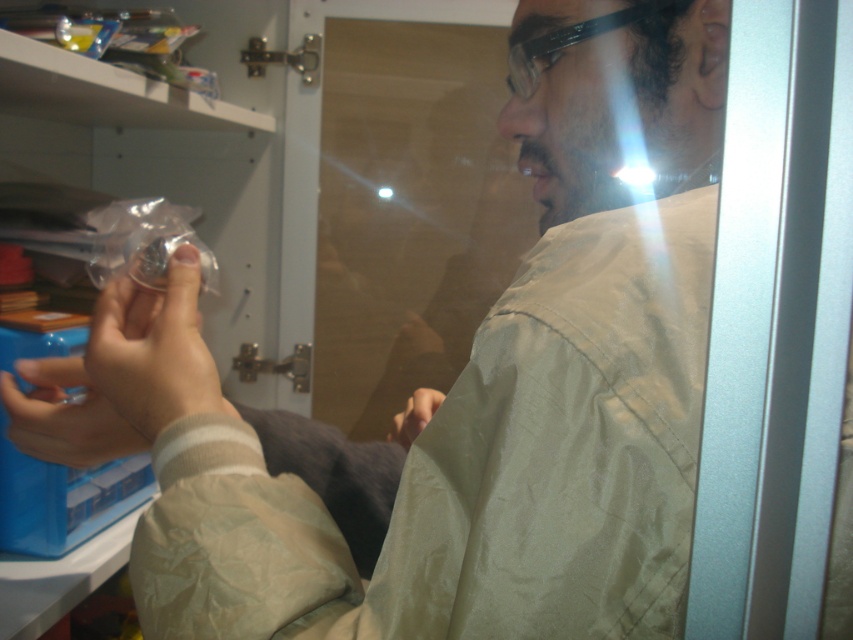
From the picture: Who is higher up, clear plastic hand at center or smooth beige hand at lower center?

Positioned higher is clear plastic hand at center.

Between point (137, 321) and point (407, 424), which one is positioned in front?

Positioned in front is point (137, 321).

Find the location of a particular element. Image resolution: width=853 pixels, height=640 pixels. clear plastic hand at center is located at coordinates (154, 349).

Who is taller, clear plastic hand at center or matte plastic ring at center?

clear plastic hand at center

Where is `clear plastic hand at center`? The image size is (853, 640). clear plastic hand at center is located at coordinates (154, 349).

Is matte plastic ring at center shorter than smooth beige hand at lower center?

No.

Who is shorter, matte plastic ring at center or smooth beige hand at lower center?

smooth beige hand at lower center

Is point (119, 416) closer to camera compared to point (428, 388)?

Yes, it is in front of point (428, 388).

Locate an element on the screen. This screenshot has height=640, width=853. matte plastic ring at center is located at coordinates (64, 416).